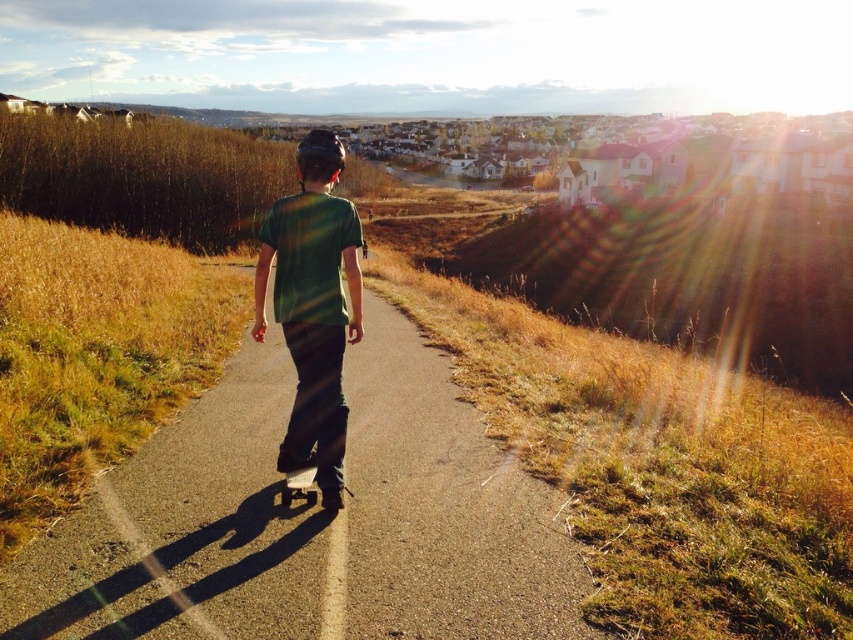
You are a delivery person who needs to transport a large package across the smooth asphalt road at center and the black matte skateboard at center. Which surface can accommodate the package without it being too small?

The smooth asphalt road at center has a larger size compared to the black matte skateboard at center, so the package can be accommodated on the smooth asphalt road at center without being too small.

You are standing at the starting point of the skate path and want to reach the point marked as point (308, 333). However, there is an obstacle at point (560, 630). Will you encounter the obstacle before reaching your destination?

Point (560, 630) is in front of point (308, 333), so yes, you will encounter the obstacle at point (560, 630) before reaching your destination point (308, 333).